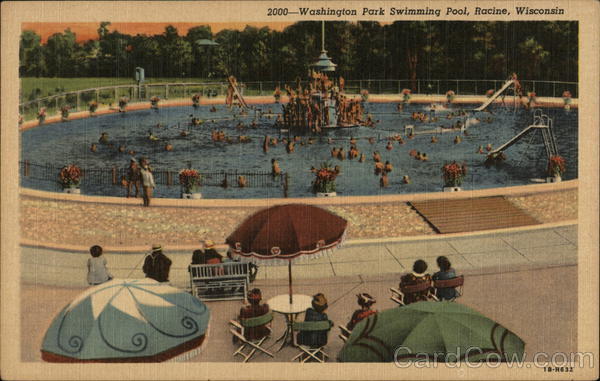
Locate an element on the screen. The width and height of the screenshot is (600, 381). bench seating is located at coordinates (228, 283).